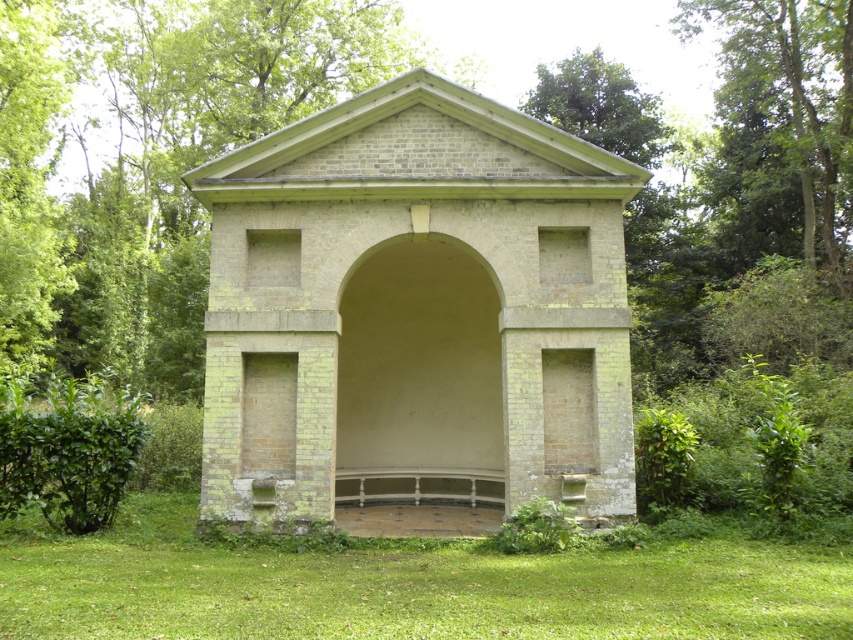
Is the position of yellow-green brick chapel at center less distant than that of green grass at lower center?

That is False.

Consider the image. Between yellow-green brick chapel at center and green grass at lower center, which one is positioned higher?

yellow-green brick chapel at center

Describe the element at coordinates (415, 310) in the screenshot. I see `yellow-green brick chapel at center` at that location.

I want to click on yellow-green brick chapel at center, so click(x=415, y=310).